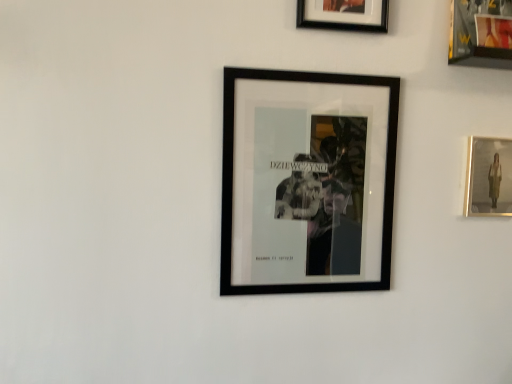
Question: Considering the positions of black matte picture frame at upper center, which appears as the 3th picture frame when viewed from the right, and matte gold picture frame at right, positioned as the 1th picture frame in right-to-left order, in the image, is black matte picture frame at upper center, which appears as the 3th picture frame when viewed from the right, bigger or smaller than matte gold picture frame at right, positioned as the 1th picture frame in right-to-left order,?

Choices:
 (A) big
 (B) small

Answer: (A)

Question: Is black matte picture frame at upper center, which ranks as the 2th picture frame in left-to-right order, taller or shorter than matte gold picture frame at right, positioned as the fourth picture frame in left-to-right order?

Choices:
 (A) short
 (B) tall

Answer: (A)

Question: Considering the real-world distances, which object is farthest from the black matte picture frame at center, which appears as the 4th picture frame when viewed from the right?

Choices:
 (A) matte gold picture frame at right, positioned as the 1th picture frame in right-to-left order
 (B) metallic gold picture frame at upper right, which appears as the 2th picture frame when viewed from the right
 (C) black matte picture frame at upper center, which ranks as the 2th picture frame in left-to-right order

Answer: (B)

Question: Estimate the real-world distances between objects in this image. Which object is farther from the matte gold picture frame at right, positioned as the 1th picture frame in right-to-left order?

Choices:
 (A) black matte picture frame at upper center, which ranks as the 2th picture frame in left-to-right order
 (B) black matte picture frame at center, which appears as the first picture frame when viewed from the left
 (C) metallic gold picture frame at upper right, which appears as the 2th picture frame when viewed from the right

Answer: (A)